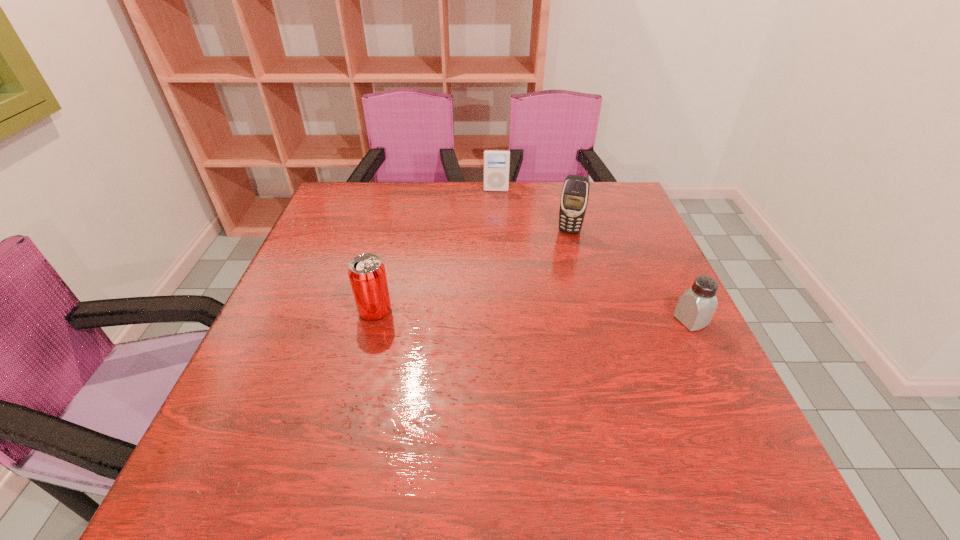
Locate an element on the screen. vacant area that lies between the third object from right to left and the saltshaker is located at coordinates (593, 255).

Where is `vacant point located between the shortest object and the soda can`? vacant point located between the shortest object and the soda can is located at coordinates (533, 316).

At what (x,y) coordinates should I click in order to perform the action: click on object that is the closest to the farthest object. Please return your answer as a coordinate pair (x, y). The image size is (960, 540). Looking at the image, I should click on (575, 193).

The width and height of the screenshot is (960, 540). I want to click on object that stands as the third closest to the farthest object, so click(696, 306).

Find the location of a particular element. Image resolution: width=960 pixels, height=540 pixels. vacant space that satisfies the following two spatial constraints: 1. on the back side of the third object from left to right; 2. on the left side of the leftmost object is located at coordinates (396, 231).